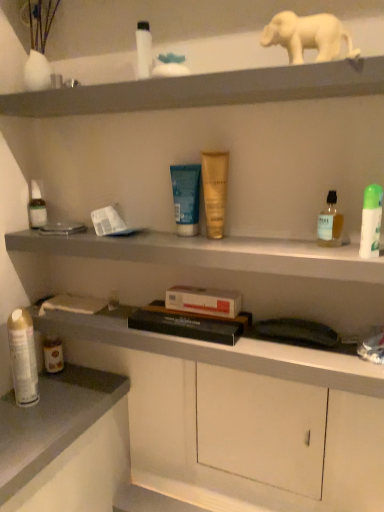
Question: Does matte gray cabinet at center turn towards translucent plastic bottle at left, acting as the sixth toiletry starting from the front?

Choices:
 (A) no
 (B) yes

Answer: (A)

Question: Does matte gray cabinet at center have a lesser width compared to translucent plastic bottle at left, placed as the 1th toiletry when sorted from left to right?

Choices:
 (A) yes
 (B) no

Answer: (B)

Question: Does matte gray cabinet at center appear on the right side of translucent plastic bottle at left, arranged as the first toiletry when viewed from the back?

Choices:
 (A) no
 (B) yes

Answer: (B)

Question: From the image's perspective, would you say matte gray cabinet at center is positioned over translucent plastic bottle at left, placed as the 1th toiletry when sorted from left to right?

Choices:
 (A) no
 (B) yes

Answer: (A)

Question: Considering the relative sizes of matte gray cabinet at center and translucent plastic bottle at left, placed as the 1th toiletry when sorted from left to right, in the image provided, is matte gray cabinet at center taller than translucent plastic bottle at left, placed as the 1th toiletry when sorted from left to right,?

Choices:
 (A) no
 (B) yes

Answer: (A)

Question: In terms of size, does hardcover book at center appear bigger or smaller than blue matte tube at center, placed as the 3th toiletry when sorted from left to right?

Choices:
 (A) big
 (B) small

Answer: (A)

Question: Considering the relative positions of hardcover book at center and blue matte tube at center, the fourth toiletry positioned from the right, in the image provided, is hardcover book at center to the left or to the right of blue matte tube at center, the fourth toiletry positioned from the right,?

Choices:
 (A) right
 (B) left

Answer: (A)

Question: Is point (243, 329) closer or farther from the camera than point (193, 201)?

Choices:
 (A) closer
 (B) farther

Answer: (A)

Question: From the image's perspective, is hardcover book at center positioned above or below blue matte tube at center, the third toiletry from the back?

Choices:
 (A) above
 (B) below

Answer: (B)

Question: Choose the correct answer: Is matte gray shelf at upper center, the 1th shelf viewed from the top, inside metallic silver spray can at lower left, positioned as the 2th toiletry in left-to-right order, or outside it?

Choices:
 (A) outside
 (B) inside

Answer: (A)

Question: Is point (8, 39) closer or farther from the camera than point (13, 379)?

Choices:
 (A) closer
 (B) farther

Answer: (A)

Question: Is matte gray shelf at upper center, the 1th shelf viewed from the top, to the left or to the right of metallic silver spray can at lower left, which is the 5th toiletry from front to back, in the image?

Choices:
 (A) left
 (B) right

Answer: (B)

Question: Looking at the image, does matte gray shelf at upper center, the 1th shelf viewed from the top, seem bigger or smaller compared to metallic silver spray can at lower left, which is the 5th toiletry from front to back?

Choices:
 (A) big
 (B) small

Answer: (A)

Question: In the image, is metallic silver spray can at lower left, which is counted as the 5th toiletry, starting from the right, positioned in front of or behind translucent plastic bottle at left, acting as the sixth toiletry starting from the front?

Choices:
 (A) behind
 (B) front

Answer: (B)

Question: Considering the positions of metallic silver spray can at lower left, which is the 5th toiletry from front to back, and translucent plastic bottle at left, placed as the 1th toiletry when sorted from left to right, in the image, is metallic silver spray can at lower left, which is the 5th toiletry from front to back, taller or shorter than translucent plastic bottle at left, placed as the 1th toiletry when sorted from left to right,?

Choices:
 (A) short
 (B) tall

Answer: (B)